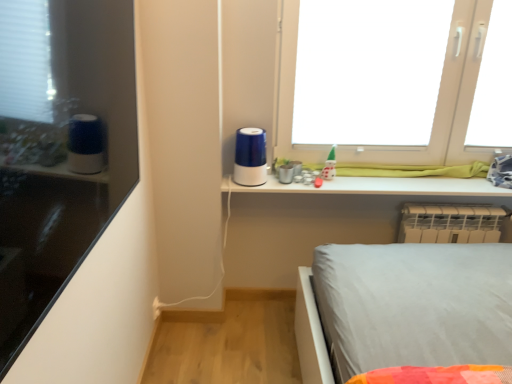
I want to click on free location to the left of green glossy toy at upper center, so click(296, 183).